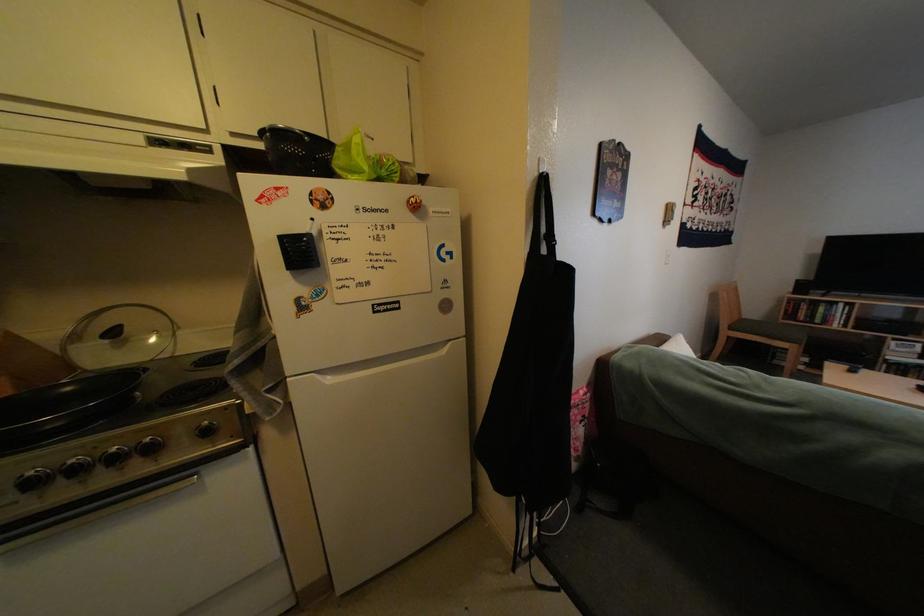
Locate an element on the screen. The width and height of the screenshot is (924, 616). sofa sitting surface is located at coordinates (774, 361).